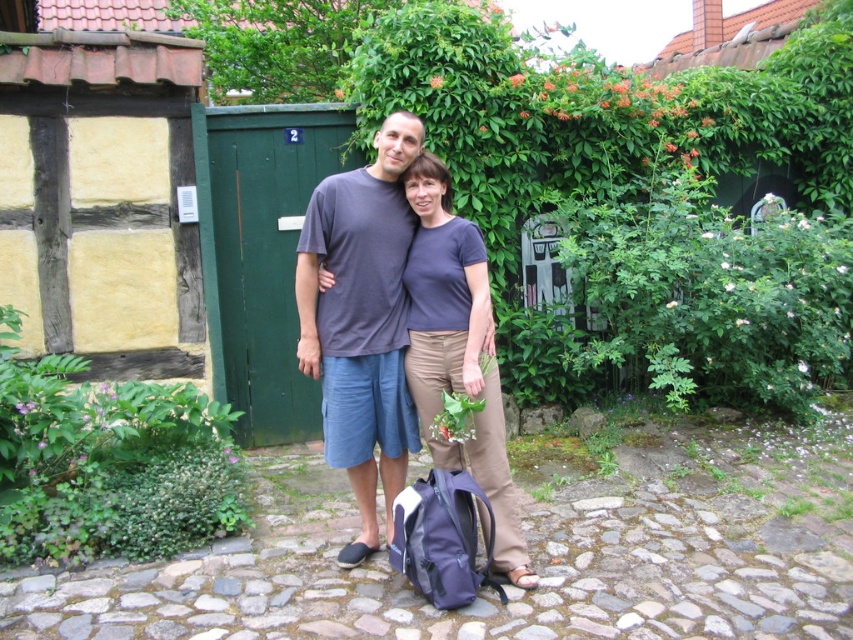
You are standing in the garden and want to take a photo of the point at coordinates (375,259). If your camera has a maximum focus range of 3 meters, will it be able to focus on the point?

The point at coordinates (375,259) is 3.25 meters away from the camera, which exceeds the maximum focus range of 3 meters. Therefore, the camera will not be able to focus on the point.

You are a photographer trying to capture the perfect shot of the dark gray T shirt at center. The camera has a fixed focus point at coordinate point (363, 321). Will the dark gray T shirt at center be in focus?

The point (363, 321) indicates dark gray t shirt at center, so yes, the dark gray T shirt at center will be in focus since the camera is focused on that point.